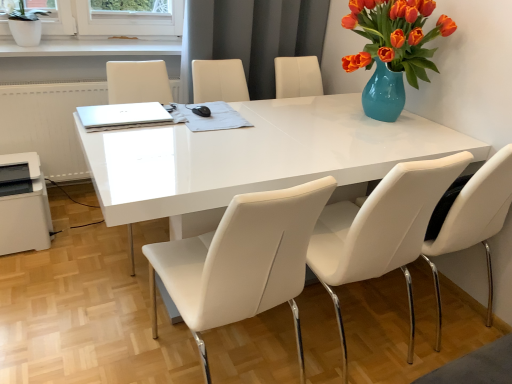
You are a GUI agent. You are given a task and a screenshot of the screen. Output one action in this format:
    pyautogui.click(x=<x>, y=<y>)
    Task: Click on the vacant area located to the right-hand side of white plastic printer at lower left
    This screenshot has width=512, height=384.
    Given the screenshot: What is the action you would take?
    pyautogui.click(x=82, y=240)